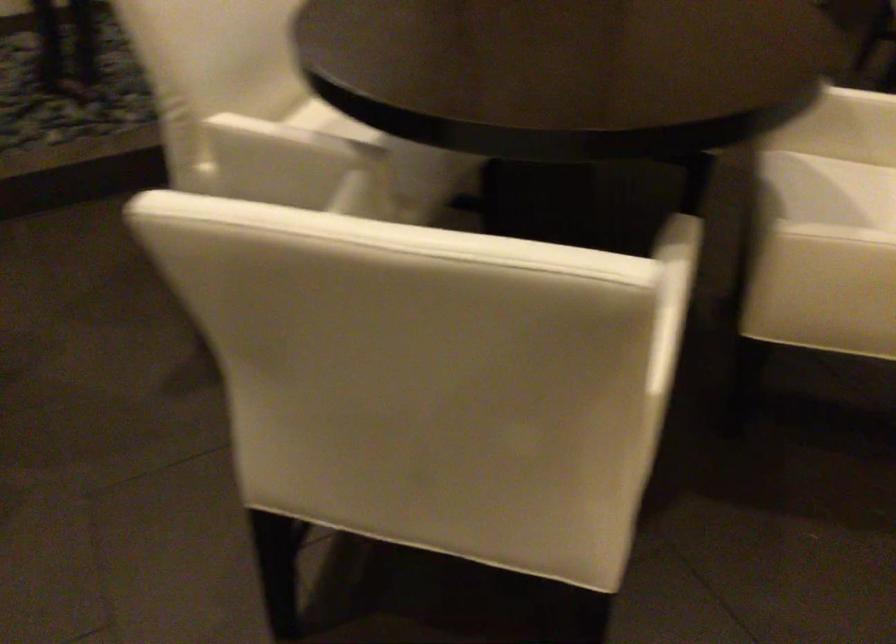
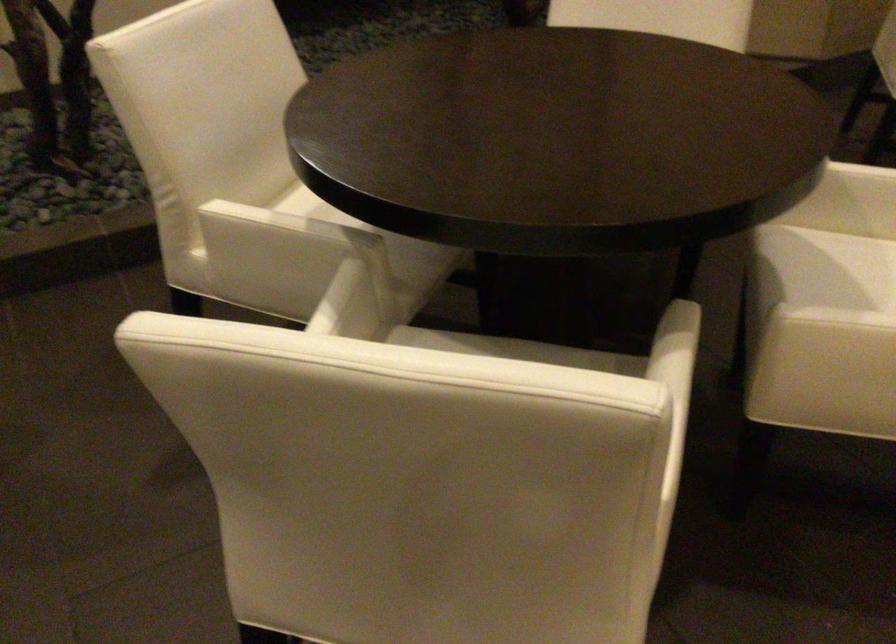
The point at (325, 71) is marked in the first image. Where is the corresponding point in the second image?

(316, 166)